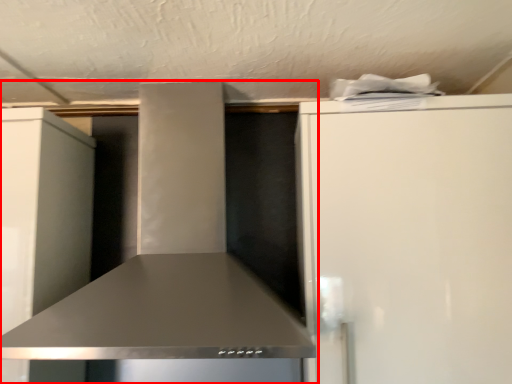
Question: From the image's perspective, considering the relative positions of home appliance (annotated by the red box) and refrigerator in the image provided, where is home appliance (annotated by the red box) located with respect to the staircase?

Choices:
 (A) below
 (B) above

Answer: (B)